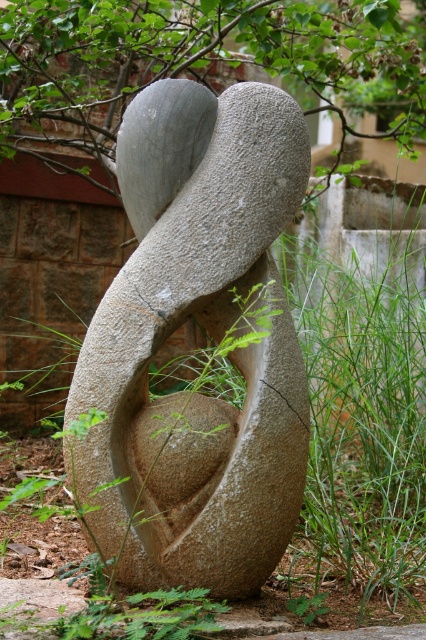
You are a landscape architect designing a garden. You need to ensure that the granite sculpture at center is visible above the green grass at center. Based on the scene description, will the sculpture be visible from a distance? Explain your reasoning.

The granite sculpture at center has a greater height compared to green grass at center, so yes, the sculpture will be visible above the green grass at center from a distance because it is taller.

Where is the granite sculpture at center located in the image?

The granite sculpture at center is located at point coordinates of approximately [210,333].